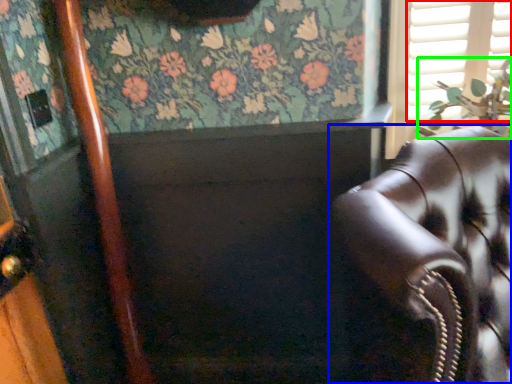
Question: Which object is positioned farthest from shutter (highlighted by a red box)? Select from chair (highlighted by a blue box) and plant (highlighted by a green box).

Choices:
 (A) chair
 (B) plant

Answer: (A)